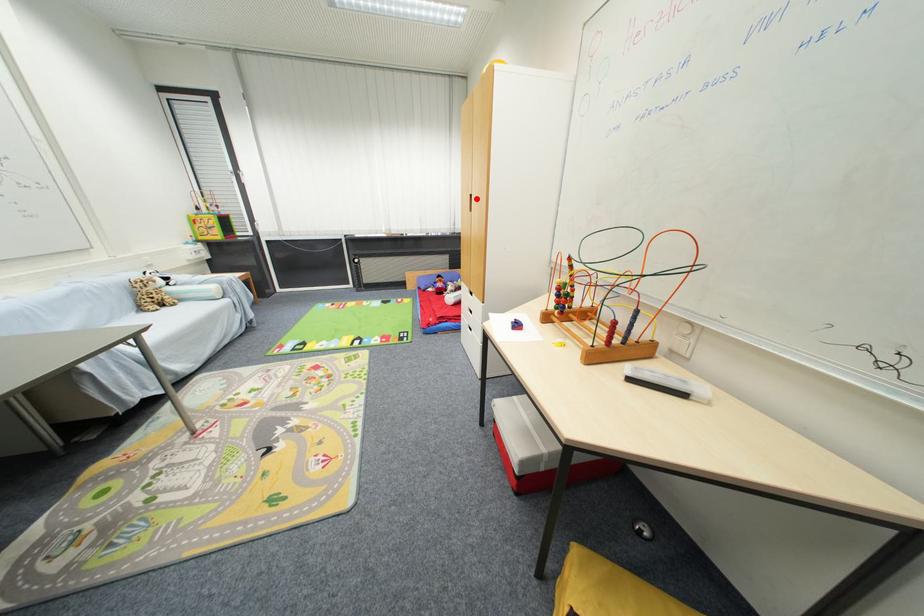
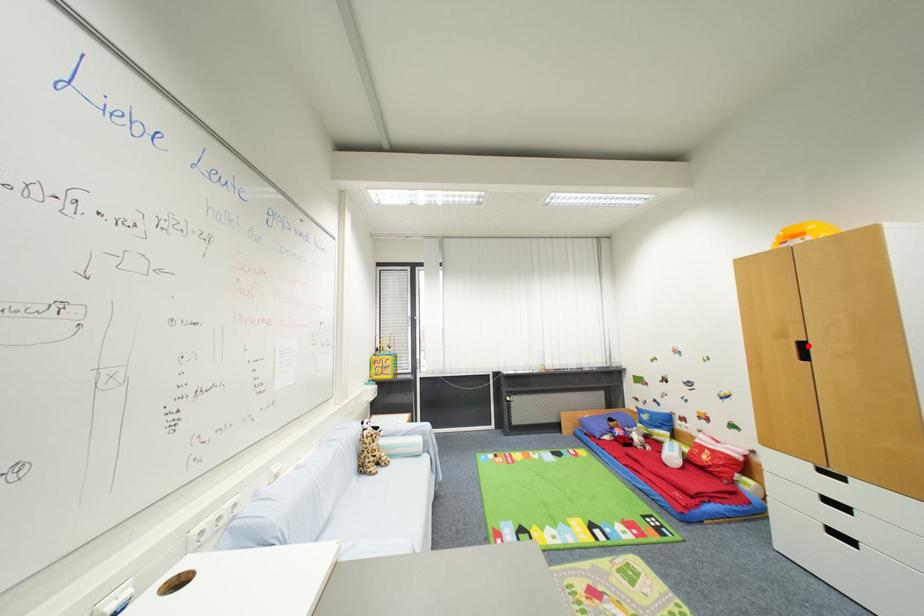
I am providing you with two images of the same scene from different viewpoints. A red point is marked on the first image and another point is marked on the second image. Is the marked point in image1 the same physical position as the marked point in image2?

Yes